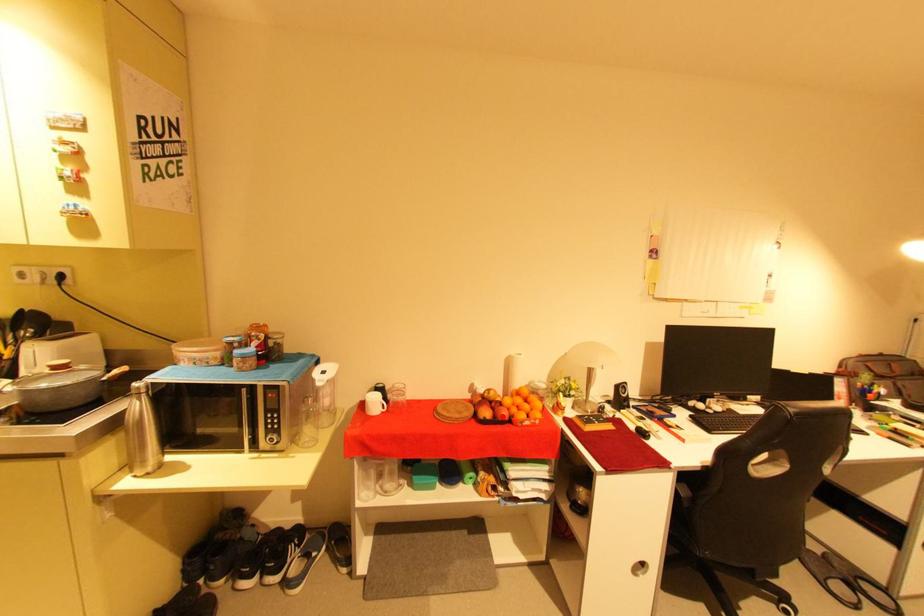
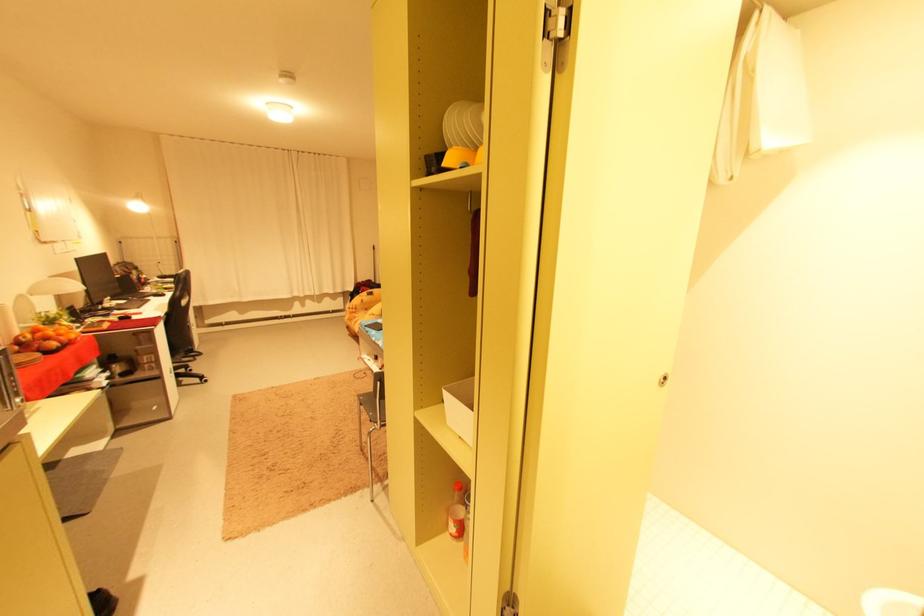
Question: I am providing you with two images of the same scene from different viewpoints. A red point is marked on the first image. Can you still see the location of the red point in image 2?

Choices:
 (A) Yes
 (B) No

Answer: (A)